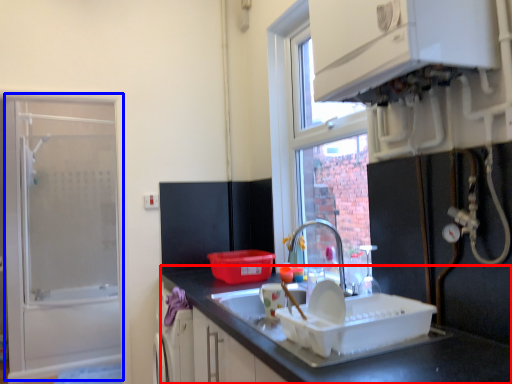
Question: Which object appears farthest to the camera in this image, countertop (highlighted by a red box) or screen door (highlighted by a blue box)?

Choices:
 (A) countertop
 (B) screen door

Answer: (B)